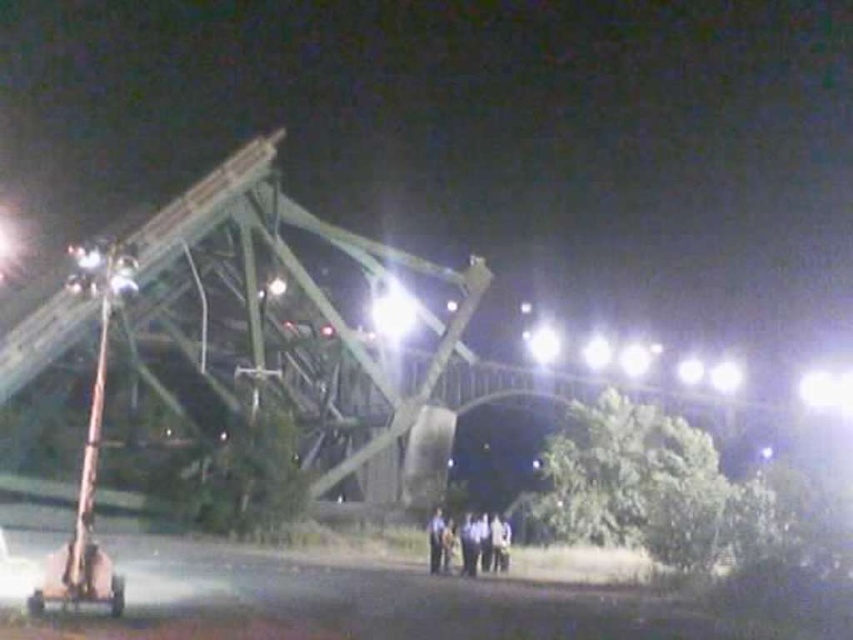
Does dark blue uniform at lower center have a greater width compared to metallic silver car at lower left?

Incorrect, dark blue uniform at lower center's width does not surpass metallic silver car at lower left's.

Can you confirm if dark blue uniform at lower center is taller than metallic silver car at lower left?

Correct, dark blue uniform at lower center is much taller as metallic silver car at lower left.

Is point (494, 524) farther from camera compared to point (22, 586)?

Yes, it is behind point (22, 586).

Locate an element on the screen. dark blue uniform at lower center is located at coordinates (480, 540).